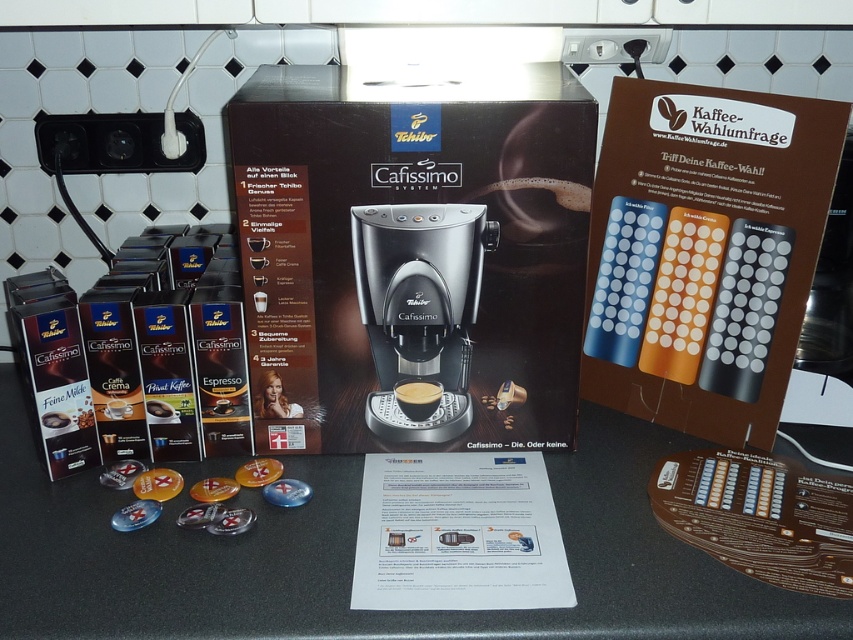
You are standing in front of the Tchibo Cafissimo System machine and want to reach the point at coordinates point (590, 458). If your arm can extend 30 inches, can you comfortably reach that point without moving your position?

The point (590, 458) is 30.78 inches away from you, so your arm can only extend 30 inches. Therefore, you cannot comfortably reach it without moving your position.

You have a small kitchen counter with limited space. You need to place both the black plastic coffee machine at center and the black glossy coffee at center on it. Considering their widths, which one should you place closer to the edge to ensure both fit without overlapping?

The black glossy coffee at center is narrower than the black plastic coffee machine at center, so place the black glossy coffee at center closer to the edge to accommodate both items on the counter without overlapping.